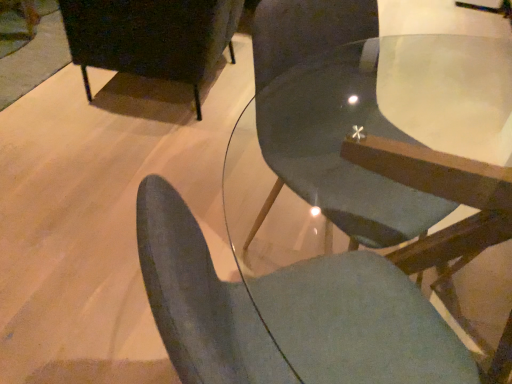
Question: Is matte gray chair at center, the first chair when ordered from front to back, at the left side of matte gray chair at center, acting as the 2th chair starting from the front?

Choices:
 (A) no
 (B) yes

Answer: (B)

Question: From the image's perspective, is matte gray chair at center, the first chair when ordered from front to back, located beneath matte gray chair at center, acting as the 2th chair starting from the front?

Choices:
 (A) yes
 (B) no

Answer: (A)

Question: Is matte gray chair at center, the first chair when ordered from front to back, located outside matte gray chair at center, which is the second chair from back to front?

Choices:
 (A) yes
 (B) no

Answer: (A)

Question: Is matte gray chair at center, the first chair when ordered from front to back, positioned with its back to matte gray chair at center, which is the second chair from back to front?

Choices:
 (A) no
 (B) yes

Answer: (A)

Question: Considering the relative sizes of matte gray chair at center, which appears as the 3th chair when viewed from the back, and matte gray chair at center, acting as the 2th chair starting from the front, in the image provided, is matte gray chair at center, which appears as the 3th chair when viewed from the back, smaller than matte gray chair at center, acting as the 2th chair starting from the front,?

Choices:
 (A) yes
 (B) no

Answer: (A)

Question: Could you tell me if matte gray chair at center, which appears as the 3th chair when viewed from the back, is turned towards matte gray chair at center, which is the second chair from back to front?

Choices:
 (A) yes
 (B) no

Answer: (B)

Question: Is matte black chair at upper left, the third chair viewed from the front, looking in the opposite direction of matte gray chair at center, which is the second chair from back to front?

Choices:
 (A) no
 (B) yes

Answer: (A)

Question: Are matte black chair at upper left, positioned as the first chair in back-to-front order, and matte gray chair at center, acting as the 2th chair starting from the front, making contact?

Choices:
 (A) no
 (B) yes

Answer: (A)

Question: Does matte black chair at upper left, positioned as the first chair in back-to-front order, have a larger size compared to matte gray chair at center, acting as the 2th chair starting from the front?

Choices:
 (A) no
 (B) yes

Answer: (B)

Question: Is matte black chair at upper left, positioned as the first chair in back-to-front order, outside of matte gray chair at center, which is the second chair from back to front?

Choices:
 (A) yes
 (B) no

Answer: (A)

Question: Is matte black chair at upper left, positioned as the first chair in back-to-front order, to the left of matte gray chair at center, acting as the 2th chair starting from the front, from the viewer's perspective?

Choices:
 (A) no
 (B) yes

Answer: (B)

Question: From a real-world perspective, is matte black chair at upper left, positioned as the first chair in back-to-front order, positioned under matte gray chair at center, acting as the 2th chair starting from the front, based on gravity?

Choices:
 (A) yes
 (B) no

Answer: (A)

Question: Does matte gray chair at center, which appears as the 3th chair when viewed from the back, have a larger size compared to matte black chair at upper left, the third chair viewed from the front?

Choices:
 (A) yes
 (B) no

Answer: (B)